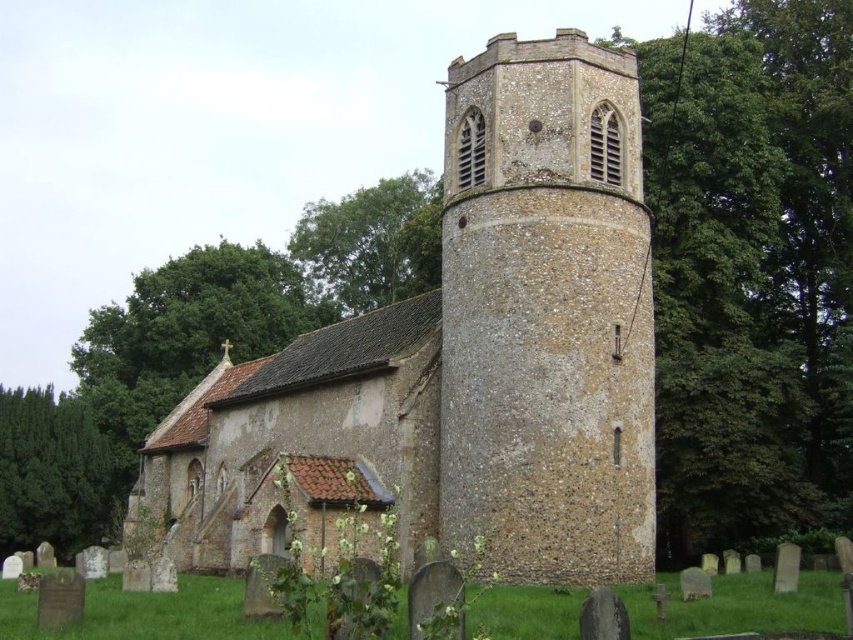
You are standing in front of the brown stone tower at center and want to enter the brown stone church at center. Which direction should you walk to reach the entrance?

You should walk downward towards the brown stone church at center since it is positioned under the brown stone tower at center, indicating it is located below the tower.

You are a visitor standing in front of the brown stone church at center and the brown stone tower at center. You want to take a photo that captures both structures in the frame. Which one should you move closer to in order to include both in your photo?

The brown stone tower at center is narrower than the brown stone church at center, so you should move closer to the brown stone church at center to ensure both fit in the frame.